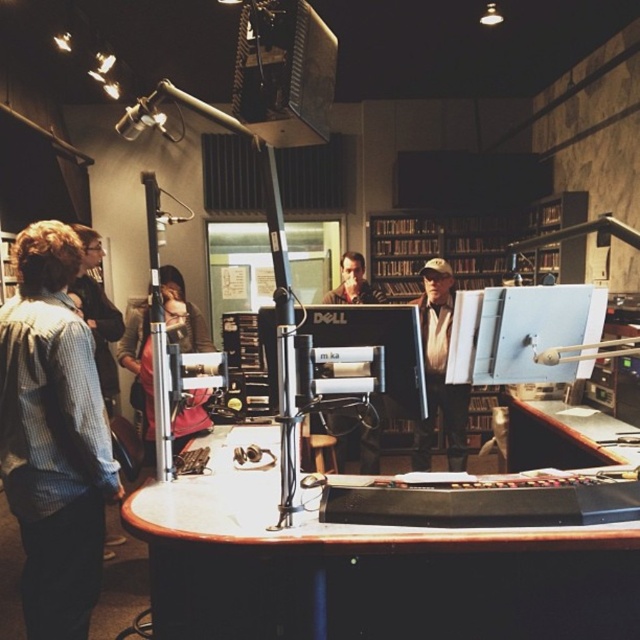
Between white glossy table at center and brown wood table at lower right, which one has less height?

With less height is brown wood table at lower right.

Who is taller, white glossy table at center or brown wood table at lower right?

With more height is white glossy table at center.

Does point (435, 596) lie behind point (572, 417)?

No, it is in front of (572, 417).

This screenshot has width=640, height=640. Find the location of `white glossy table at center`. white glossy table at center is located at coordinates (369, 570).

Can you confirm if blue plaid shirt at left is positioned below khaki cotton cap at center?

Yes, blue plaid shirt at left is below khaki cotton cap at center.

Which is in front, point (8, 358) or point (417, 440)?

Positioned in front is point (8, 358).

What are the coordinates of `blue plaid shirt at left` in the screenshot? It's located at (52, 435).

Does point (460, 467) lie in front of point (570, 442)?

No, it is not.

Who is positioned more to the left, khaki cotton cap at center or brown wood table at lower right?

From the viewer's perspective, khaki cotton cap at center appears more on the left side.

Which is in front, point (445, 291) or point (572, 419)?

Point (572, 419) is in front.

Where is `khaki cotton cap at center`? The width and height of the screenshot is (640, 640). khaki cotton cap at center is located at coordinates (440, 371).